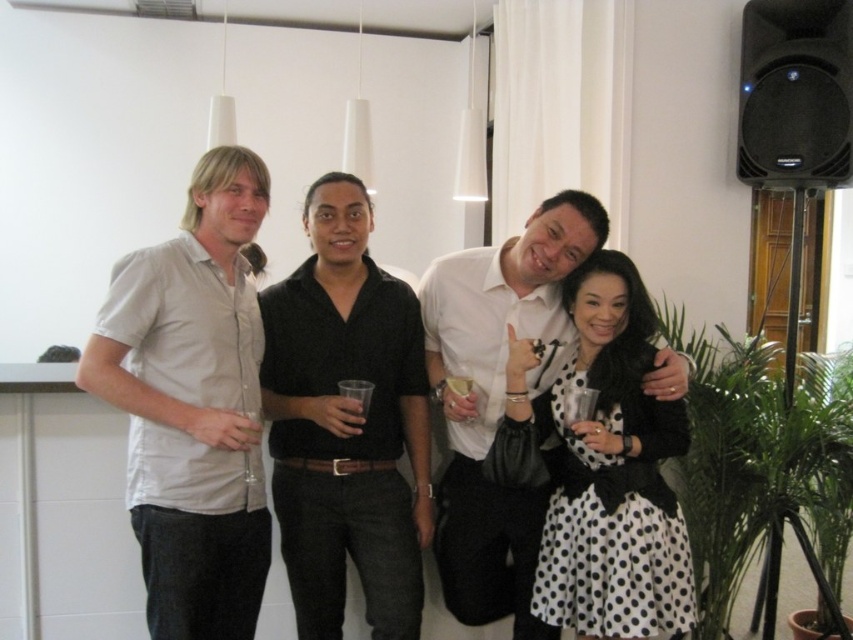
You are a photographer adjusting the camera focus. You need to ensure both the black smooth shirt at center and the white opaque glass at center are in focus. Which object should you adjust the focus on first to account for their sizes?

The black smooth shirt at center is larger in size than the white opaque glass at center. Therefore, you should focus on the black smooth shirt at center first since it occupies more of the frame and requires precise focus to capture details effectively.

You are a photographer setting up for a group photo. You need to ensure that the light gray cotton shirt at left and the black plastic speaker at upper right are both visible in the frame. Based on their sizes, which object should you prioritize keeping in the foreground to ensure visibility?

The light gray cotton shirt at left is much taller than the black plastic speaker at upper right, so you should prioritize keeping the light gray cotton shirt at left in the foreground to ensure visibility.

You are standing in the room and see two points marked in the image. Which point is closer to you, point (323, 225) or point (347, 394)?

Point (323, 225) is further to the camera than point (347, 394), so the closer point to you is point (347, 394).